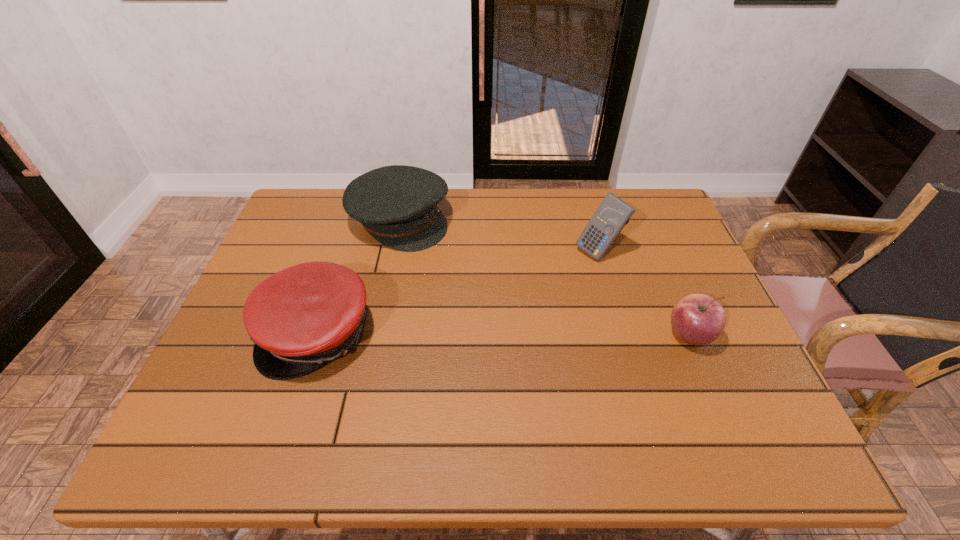
Select which object is the closest to the apple. Please provide its 2D coordinates. Your answer should be formatted as a tuple, i.e. [(x, y)], where the tuple contains the x and y coordinates of a point satisfying the conditions above.

[(613, 213)]

What are the coordinates of `vacant point that satisfies the following two spatial constraints: 1. at the front of the cap where the visor is located; 2. on the right side of the rightmost object` in the screenshot? It's located at click(317, 336).

Identify the location of free location that satisfies the following two spatial constraints: 1. on the front side of the beret; 2. on the right side of the tallest object. (394, 251).

The width and height of the screenshot is (960, 540). In order to click on vacant region that satisfies the following two spatial constraints: 1. at the front of the apple where the visor is located; 2. on the right side of the cap in this screenshot , I will do 317,336.

Find the location of a particular element. This screenshot has width=960, height=540. vacant space that satisfies the following two spatial constraints: 1. at the front of the apple where the visor is located; 2. on the right side of the cap is located at coordinates (317, 336).

Image resolution: width=960 pixels, height=540 pixels. Find the location of `vacant area that satisfies the following two spatial constraints: 1. on the front side of the apple; 2. on the right side of the beret`. vacant area that satisfies the following two spatial constraints: 1. on the front side of the apple; 2. on the right side of the beret is located at coordinates pyautogui.click(x=375, y=336).

You are a GUI agent. You are given a task and a screenshot of the screen. Output one action in this format:
    pyautogui.click(x=<x>, y=<y>)
    Task: Click on the vacant region that satisfies the following two spatial constraints: 1. at the front of the cap where the visor is located; 2. on the left side of the apple
    The width and height of the screenshot is (960, 540).
    Given the screenshot: What is the action you would take?
    pyautogui.click(x=317, y=336)